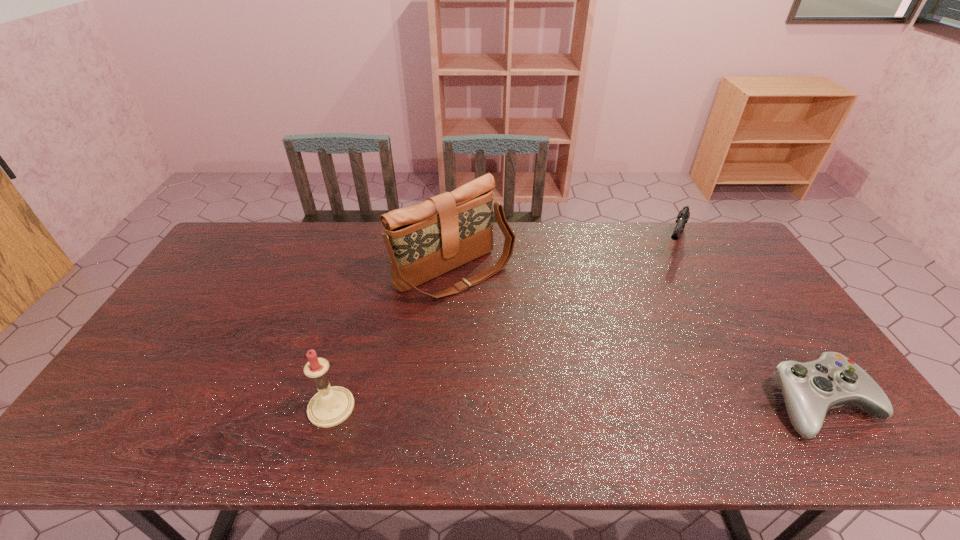
The width and height of the screenshot is (960, 540). What are the coordinates of `object that is at the far right corner` in the screenshot? It's located at (683, 216).

Identify the location of object present at the near right corner. (810, 389).

In the image, there is a desktop. In order to click on free region at the far edge in this screenshot , I will do `click(692, 256)`.

In the image, there is a desktop. Where is `free space at the near edge`? This screenshot has width=960, height=540. free space at the near edge is located at coordinates (511, 401).

Find the location of `free space at the left edge of the desktop`. free space at the left edge of the desktop is located at coordinates (204, 291).

Image resolution: width=960 pixels, height=540 pixels. In the image, there is a desktop. What are the coordinates of `vacant area at the right edge` in the screenshot? It's located at (730, 288).

The width and height of the screenshot is (960, 540). In order to click on free spot at the far left corner of the desktop in this screenshot , I will do `click(255, 253)`.

The height and width of the screenshot is (540, 960). Identify the location of free space at the far right corner. (703, 243).

The image size is (960, 540). Identify the location of free spot between the candle and the gun. (502, 326).

Locate an element on the screen. The image size is (960, 540). free space between the control and the gun is located at coordinates (749, 324).